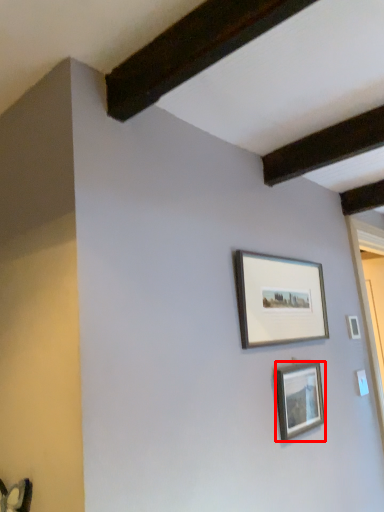
Question: From the image's perspective, where is picture frame (annotated by the red box) located in relation to picture frame in the image?

Choices:
 (A) above
 (B) below

Answer: (B)